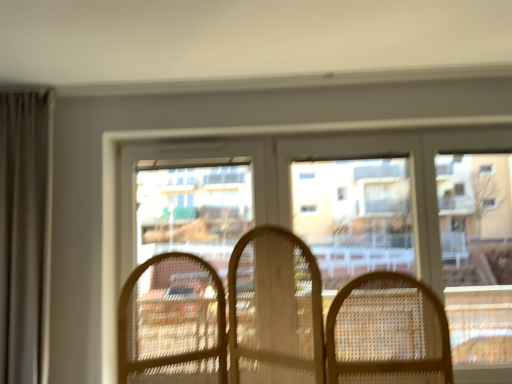
What do you see at coordinates (354, 215) in the screenshot?
I see `clear plastic window screen at center` at bounding box center [354, 215].

Identify the location of translucent wicker chairs at center. (316, 159).

In order to face clear plastic screen door at center, should I rotate leftwards or rightwards?

To face it directly, rotate left by 8.285 degrees.

You are a GUI agent. You are given a task and a screenshot of the screen. Output one action in this format:
    pyautogui.click(x=<x>, y=<y>)
    Task: Click on the clear plastic window screen at center
    The image size is (512, 384).
    Given the screenshot: What is the action you would take?
    pyautogui.click(x=354, y=215)

Is clear plastic screen door at center closer to the viewer compared to translucent wicker chairs at center?

No, the depth of clear plastic screen door at center is greater than that of translucent wicker chairs at center.

Where is `screen door that is above the translucent wicker chairs at center (from a real-world perspective)`? Image resolution: width=512 pixels, height=384 pixels. screen door that is above the translucent wicker chairs at center (from a real-world perspective) is located at coordinates (186, 203).

Is point (128, 202) closer or farther from the camera than point (433, 187)?

Point (128, 202).

Which is more to the left, translucent wicker chairs at center or clear plastic screen door at center?

clear plastic screen door at center.

The height and width of the screenshot is (384, 512). Find the location of `screen door located above the translucent wicker chairs at center (from a real-world perspective)`. screen door located above the translucent wicker chairs at center (from a real-world perspective) is located at coordinates (186, 203).

Is translucent wicker chairs at center looking in the opposite direction of clear plastic screen door at center?

Yes, clear plastic screen door at center is at the back of translucent wicker chairs at center.

Image resolution: width=512 pixels, height=384 pixels. I want to click on screen door behind the clear plastic window screen at center, so click(x=186, y=203).

Consider the image. In terms of height, does clear plastic screen door at center look taller or shorter compared to clear plastic window screen at center?

→ Considering their sizes, clear plastic screen door at center has more height than clear plastic window screen at center.

Is the position of clear plastic screen door at center less distant than that of clear plastic window screen at center?

No.

Considering the positions of objects clear plastic window screen at center and clear plastic screen door at center in the image provided, who is more to the left, clear plastic window screen at center or clear plastic screen door at center?

clear plastic screen door at center.

Does clear plastic window screen at center have a larger size compared to clear plastic screen door at center?

Incorrect, clear plastic window screen at center is not larger than clear plastic screen door at center.

Is clear plastic screen door at center at the back of clear plastic window screen at center?

No, clear plastic window screen at center is not facing the opposite direction of clear plastic screen door at center.

Locate an element on the screen. screen door on the left of clear plastic window screen at center is located at coordinates (186, 203).

Is clear plastic window screen at center far away from translucent wicker chairs at center?

No, clear plastic window screen at center is not far from translucent wicker chairs at center.

From the picture: In terms of size, does clear plastic window screen at center appear bigger or smaller than translucent wicker chairs at center?

clear plastic window screen at center is smaller than translucent wicker chairs at center.

Is clear plastic window screen at center shorter than translucent wicker chairs at center?

No, clear plastic window screen at center is not shorter than translucent wicker chairs at center.

From a real-world perspective, does clear plastic window screen at center sit lower than translucent wicker chairs at center?

No.

Which is correct: translucent wicker chairs at center is inside clear plastic window screen at center, or outside of it?

translucent wicker chairs at center is located beyond the bounds of clear plastic window screen at center.

From the picture: What's the angular difference between translucent wicker chairs at center and clear plastic window screen at center's facing directions?

There is a 4.18-degree angle between the facing directions of translucent wicker chairs at center and clear plastic window screen at center.

Looking at this image, how far apart are translucent wicker chairs at center and clear plastic window screen at center?

translucent wicker chairs at center is 31.74 centimeters away from clear plastic window screen at center.

Between translucent wicker chairs at center and clear plastic window screen at center, which one has smaller size?

With smaller size is clear plastic window screen at center.

The image size is (512, 384). I want to click on window that appears below the clear plastic screen door at center (from the image's perspective), so click(316, 159).

Find the location of `screen door above the translucent wicker chairs at center (from the image's perspective)`. screen door above the translucent wicker chairs at center (from the image's perspective) is located at coordinates (186, 203).

Estimate the real-world distances between objects in this image. Which object is closer to clear plastic screen door at center, clear plastic window screen at center or translucent wicker chairs at center?

Among the two, translucent wicker chairs at center is located nearer to clear plastic screen door at center.

Based on their spatial positions, is translucent wicker chairs at center or clear plastic screen door at center closer to clear plastic window screen at center?

translucent wicker chairs at center.

Based on the photo, based on their spatial positions, is clear plastic screen door at center or clear plastic window screen at center closer to translucent wicker chairs at center?

Based on the image, clear plastic screen door at center appears to be nearer to translucent wicker chairs at center.

Looking at the image, which one is located closer to clear plastic window screen at center, clear plastic screen door at center or translucent wicker chairs at center?

translucent wicker chairs at center lies closer to clear plastic window screen at center than the other object.

Which object lies further to the anchor point clear plastic screen door at center, translucent wicker chairs at center or clear plastic window screen at center?

clear plastic window screen at center is further to clear plastic screen door at center.

In the scene shown: Estimate the real-world distances between objects in this image. Which object is closer to translucent wicker chairs at center, clear plastic window screen at center or clear plastic screen door at center?

Based on the image, clear plastic screen door at center appears to be nearer to translucent wicker chairs at center.

Locate an element on the screen. This screenshot has height=384, width=512. window between clear plastic screen door at center and clear plastic window screen at center is located at coordinates (316, 159).